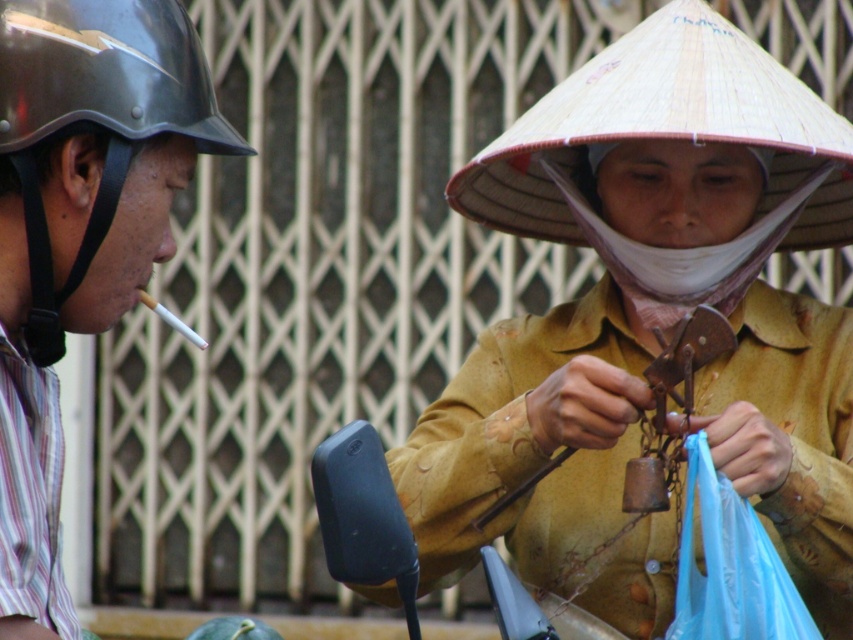
Question: Which object is positioned farthest from the green matte watermelon at lower left?

Choices:
 (A) blue plastic bag at lower right
 (B) matte yellow shirt at center
 (C) shiny black helmet at left
 (D) natural straw conical hat at upper right

Answer: (C)

Question: Does natural straw conical hat at upper right appear over shiny black helmet at left?

Choices:
 (A) yes
 (B) no

Answer: (A)

Question: Is shiny black helmet at left above blue plastic bag at lower right?

Choices:
 (A) no
 (B) yes

Answer: (B)

Question: Which point is closer to the camera?

Choices:
 (A) natural straw conical hat at upper right
 (B) green matte watermelon at lower left
 (C) shiny black helmet at left
 (D) blue plastic bag at lower right

Answer: (D)

Question: Estimate the real-world distances between objects in this image. Which object is farther from the shiny black helmet at left?

Choices:
 (A) green matte watermelon at lower left
 (B) blue plastic bag at lower right

Answer: (A)

Question: Is matte yellow shirt at center positioned at the back of green matte watermelon at lower left?

Choices:
 (A) yes
 (B) no

Answer: (B)